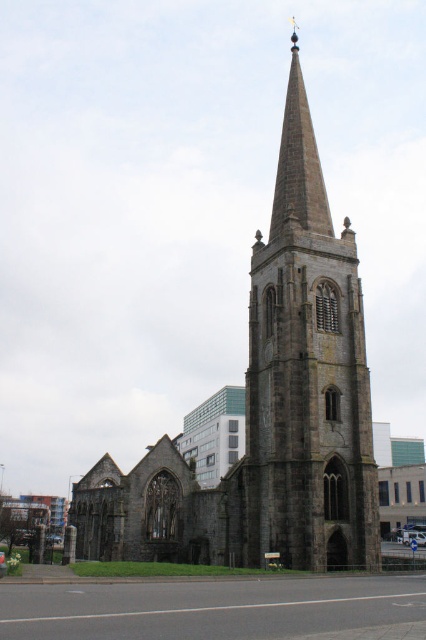
You are standing at the center of the image. Where is the dark gray stone church at center located relative to your position?

The dark gray stone church at center is located at point coordinates of (268, 410).

You are standing at the point with coordinates (268, 410) in the image. What object are you most likely standing in front of?

The point at coordinates (268, 410) corresponds to the dark gray stone church at center, so you are most likely standing in front of the dark gray stone church at center.

You are a delivery person who needs to park your van, which is 3 meters long, between the dark gray stone church at center and the dark gray stone tower at center. Can you park your van there without it overlapping either structure?

The distance between the dark gray stone church at center and the dark gray stone tower at center is 3.27 meters. Since your van is 3 meters long, there is enough space to park it between them without overlapping either structure.